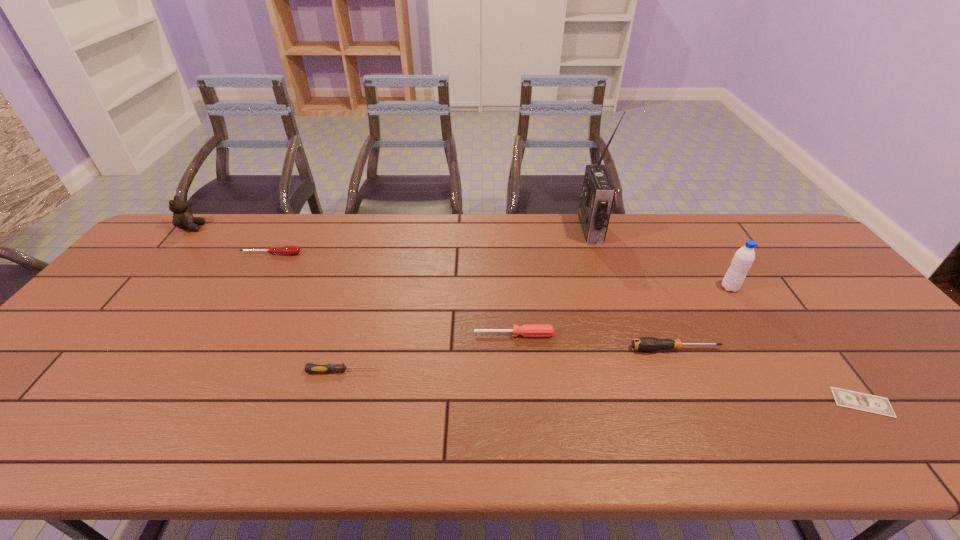
Where is `vacant space that's between the third object from left to right and the leftmost screwdriver`? This screenshot has height=540, width=960. vacant space that's between the third object from left to right and the leftmost screwdriver is located at coordinates 306,313.

The height and width of the screenshot is (540, 960). Find the location of `free point between the tallest object and the money`. free point between the tallest object and the money is located at coordinates (727, 316).

Locate an element on the screen. Image resolution: width=960 pixels, height=540 pixels. free space between the sixth farthest object and the sixth object from right to left is located at coordinates (509, 360).

You are a GUI agent. You are given a task and a screenshot of the screen. Output one action in this format:
    pyautogui.click(x=<x>, y=<y>)
    Task: Click on the vacant space in between the leftmost object and the second tallest object
    Image resolution: width=960 pixels, height=540 pixels.
    Given the screenshot: What is the action you would take?
    pyautogui.click(x=461, y=258)

At what (x,y) coordinates should I click in order to perform the action: click on free space between the seventh object from right to left and the sixth farthest object. Please return your answer as a coordinate pair (x, y). The height and width of the screenshot is (540, 960). Looking at the image, I should click on (473, 301).

Find the location of a particular element. blank region between the radio receiver and the rightmost screwdriver is located at coordinates (633, 289).

Locate an element on the screen. Image resolution: width=960 pixels, height=540 pixels. free space between the farthest screwdriver and the second farthest screwdriver is located at coordinates (393, 294).

Where is `object that stands as the fifth closest to the water bottle`? The width and height of the screenshot is (960, 540). object that stands as the fifth closest to the water bottle is located at coordinates (309, 367).

Locate an element on the screen. Image resolution: width=960 pixels, height=540 pixels. object that is the fourth closest to the third tallest object is located at coordinates (598, 192).

Identify which screwdriver is the fourth closest to the rightmost object. Please provide its 2D coordinates. Your answer should be formatted as a tuple, i.e. [(x, y)], where the tuple contains the x and y coordinates of a point satisfying the conditions above.

[(288, 250)]